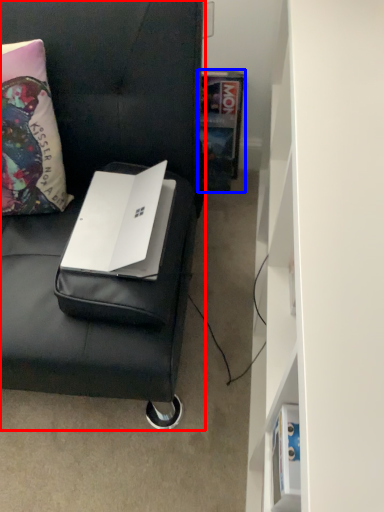
Question: Which point is further to the camera, furniture (highlighted by a red box) or book (highlighted by a blue box)?

Choices:
 (A) furniture
 (B) book

Answer: (B)